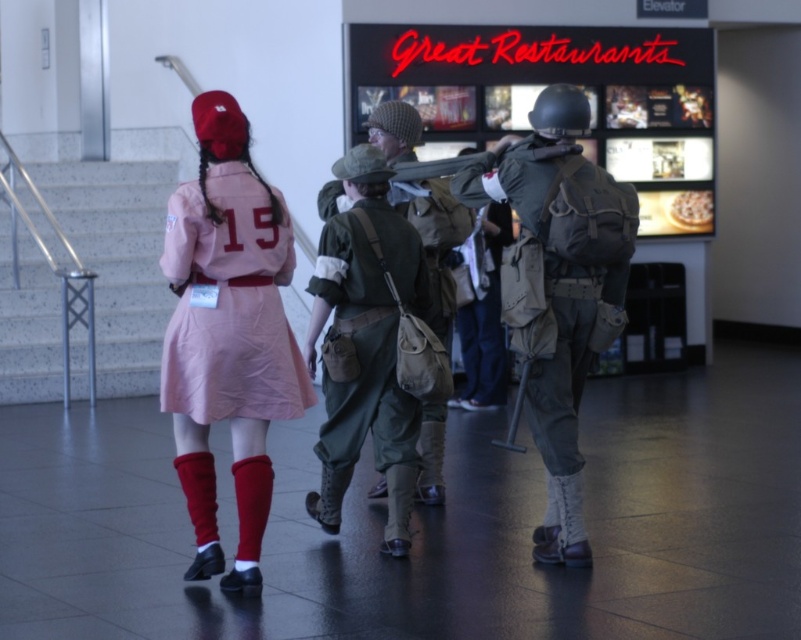
Can you confirm if pink fabric dress at center is positioned below green canvas backpack at center?

Yes.

Is pink fabric dress at center taller than green canvas backpack at center?

Yes, pink fabric dress at center is taller than green canvas backpack at center.

The height and width of the screenshot is (640, 801). What do you see at coordinates (228, 333) in the screenshot?
I see `pink fabric dress at center` at bounding box center [228, 333].

Image resolution: width=801 pixels, height=640 pixels. I want to click on pink fabric dress at center, so tap(228, 333).

From the picture: Is pink fabric dress at center positioned before camouflage fabric backpack at center?

Yes, it is in front of camouflage fabric backpack at center.

Between pink fabric dress at center and camouflage fabric backpack at center, which one appears on the left side from the viewer's perspective?

Positioned to the left is pink fabric dress at center.

Where is `pink fabric dress at center`? pink fabric dress at center is located at coordinates (228, 333).

I want to click on pink fabric dress at center, so click(228, 333).

Does camouflage fabric backpack at center appear on the left side of green canvas backpack at center?

Incorrect, camouflage fabric backpack at center is not on the left side of green canvas backpack at center.

Who is positioned more to the right, camouflage fabric backpack at center or green canvas backpack at center?

camouflage fabric backpack at center

Which is in front, point (524, 342) or point (409, 218)?

Point (524, 342)

This screenshot has width=801, height=640. Identify the location of camouflage fabric backpack at center. (558, 288).